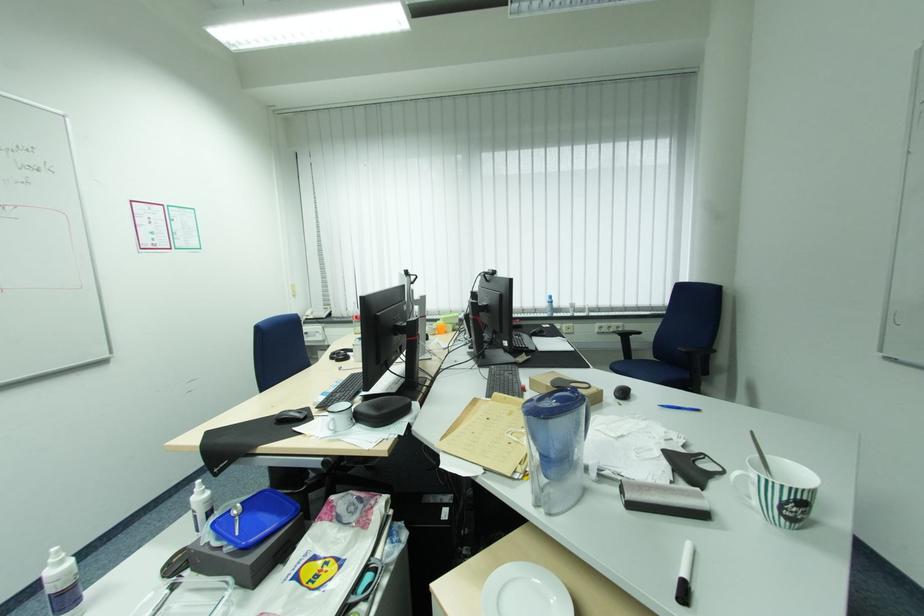
At what (x,y) coordinates should I click in order to perform the action: click on spray bottle nozzle. Please return your answer as a coordinate pair (x, y). Image resolution: width=924 pixels, height=616 pixels. Looking at the image, I should click on (199, 488).